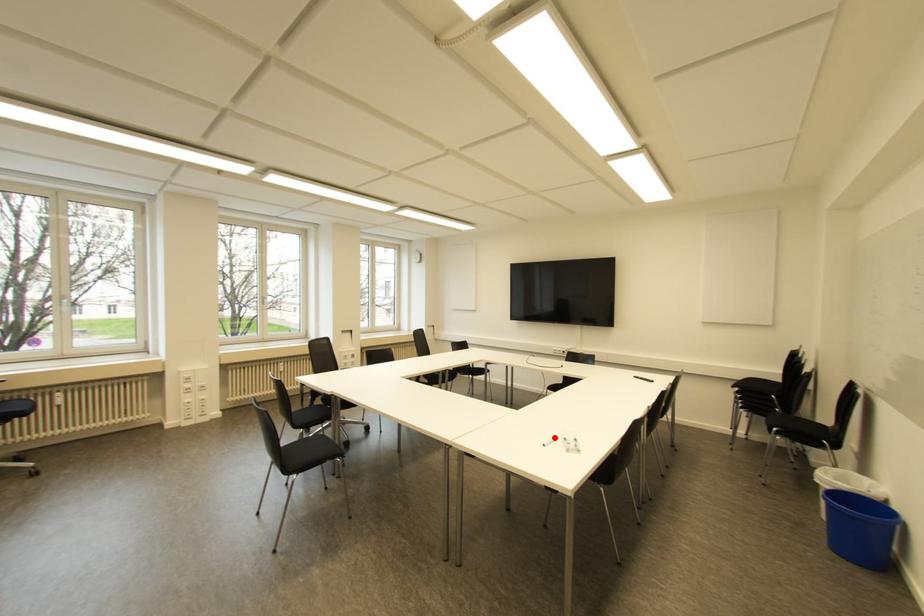
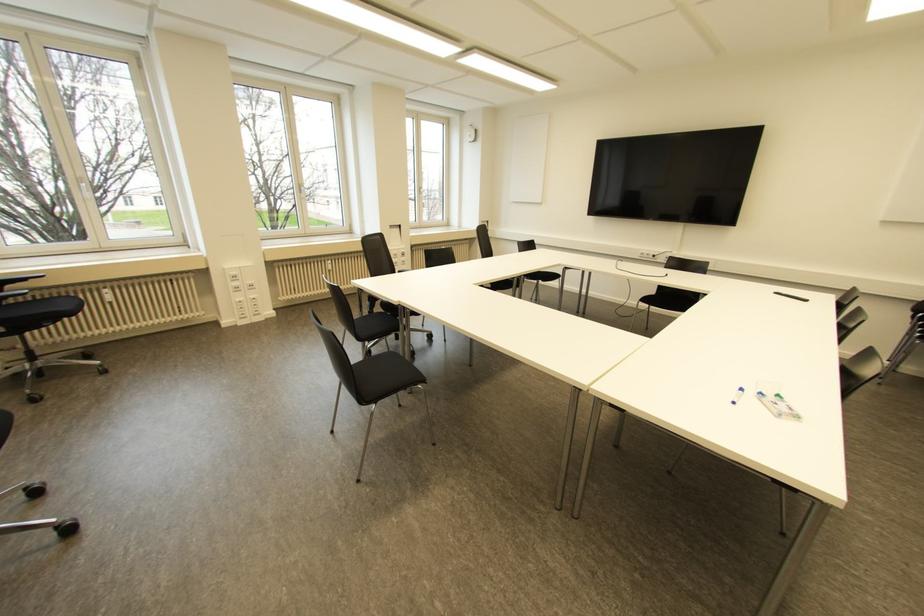
The point at the highlighted location is marked in the first image. Where is the corresponding point in the second image?

(739, 390)